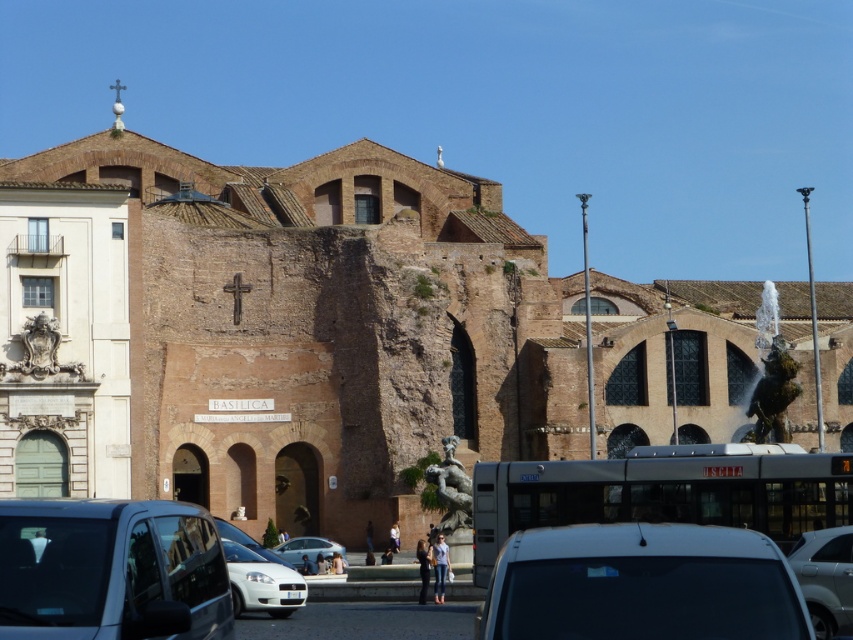
Question: From the image, what is the correct spatial relationship of matte black car at lower left in relation to silver metallic sedan at center?

Choices:
 (A) right
 (B) left

Answer: (B)

Question: Which of these objects is positioned closest to the white matte car at lower center?

Choices:
 (A) silver metallic sedan at center
 (B) white matte car at center
 (C) white matte van at lower center

Answer: (B)

Question: Is matte black car at lower left to the right of white matte car at lower center from the viewer's perspective?

Choices:
 (A) no
 (B) yes

Answer: (B)

Question: Which object is positioned closest to the white matte car at lower center?

Choices:
 (A) white matte car at center
 (B) white matte van at lower center

Answer: (A)

Question: Which point is farther to the camera?

Choices:
 (A) white matte car at center
 (B) silver metallic sedan at center
 (C) white matte car at lower center

Answer: (A)

Question: Can you confirm if white matte van at lower center is wider than silver metallic sedan at center?

Choices:
 (A) no
 (B) yes

Answer: (B)